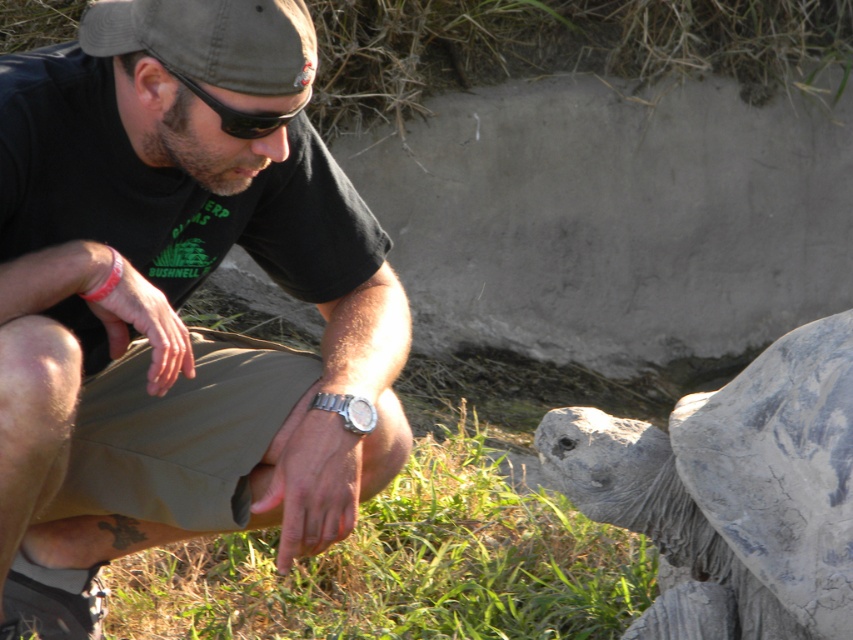
Question: Which object is the farthest from the silver metallic watch at lower center?

Choices:
 (A) gray rough shell at lower right
 (B) green fabric cap at upper left

Answer: (A)

Question: Does gray rough shell at lower right appear on the right side of black rubber goggles at upper center?

Choices:
 (A) yes
 (B) no

Answer: (A)

Question: Does gray rough shell at lower right appear on the right side of green fabric cap at upper left?

Choices:
 (A) yes
 (B) no

Answer: (A)

Question: Does dark green t-shirt at center appear over green fabric cap at upper left?

Choices:
 (A) yes
 (B) no

Answer: (B)

Question: Which is farther from the green fabric cap at upper left?

Choices:
 (A) gray rough shell at lower right
 (B) black rubber goggles at upper center
 (C) silver metallic watch at lower center

Answer: (A)

Question: Among these points, which one is nearest to the camera?

Choices:
 (A) (337, 404)
 (B) (277, 196)

Answer: (A)